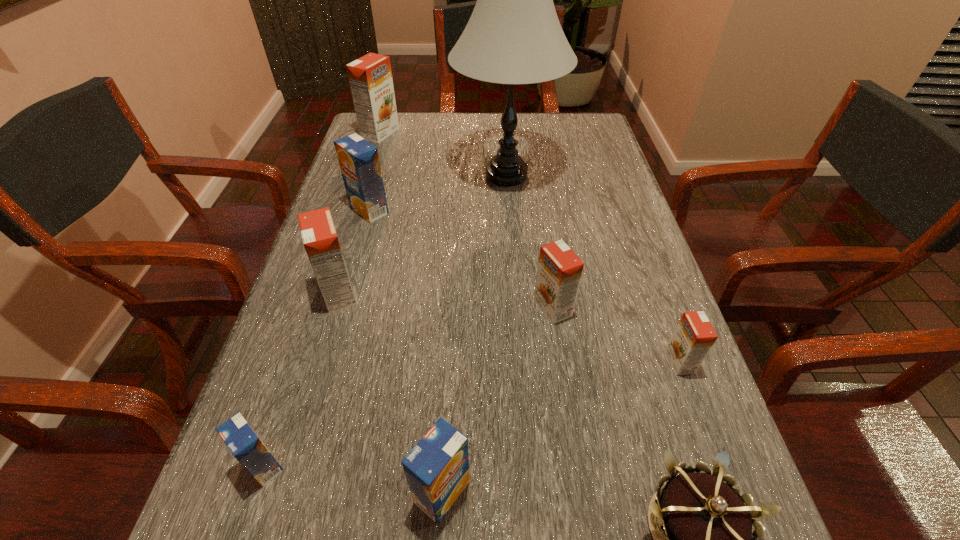
This screenshot has height=540, width=960. I want to click on orange juice that is the sixth closest to the gold crown, so (359, 162).

Image resolution: width=960 pixels, height=540 pixels. In order to click on orange juice object that ranks as the third closest to the second biggest orange orange juice in this screenshot , I will do `click(437, 468)`.

At what (x,y) coordinates should I click in order to perform the action: click on the third closest orange orange juice to the nearest orange orange juice. Please return your answer as a coordinate pair (x, y). This screenshot has height=540, width=960. Looking at the image, I should click on point(370,77).

Image resolution: width=960 pixels, height=540 pixels. What are the coordinates of `orange orange juice that is the second nearest to the third smallest orange orange juice` in the screenshot? It's located at (370, 77).

The width and height of the screenshot is (960, 540). I want to click on blue orange_juice that is the nearest to the gold crown, so click(437, 468).

Identify which blue orange_juice is located as the nearest to the smallest blue orange_juice. Please provide its 2D coordinates. Your answer should be formatted as a tuple, i.e. [(x, y)], where the tuple contains the x and y coordinates of a point satisfying the conditions above.

[(437, 468)]

Locate an element on the screen. The width and height of the screenshot is (960, 540). vacant space that satisfies the following two spatial constraints: 1. on the front side of the fifth orange juice from left to right; 2. on the right side of the smallest blue orange_juice is located at coordinates (255, 492).

You are a GUI agent. You are given a task and a screenshot of the screen. Output one action in this format:
    pyautogui.click(x=<x>, y=<y>)
    Task: Click on the vacant space that satisfies the following two spatial constraints: 1. on the back side of the rightmost blue orange_juice; 2. on the left side of the rightmost orange orange juice
    
    Given the screenshot: What is the action you would take?
    pyautogui.click(x=449, y=362)

I want to click on vacant position in the image that satisfies the following two spatial constraints: 1. on the front side of the second biggest orange orange juice; 2. on the right side of the fifth farthest orange juice, so click(x=319, y=362).